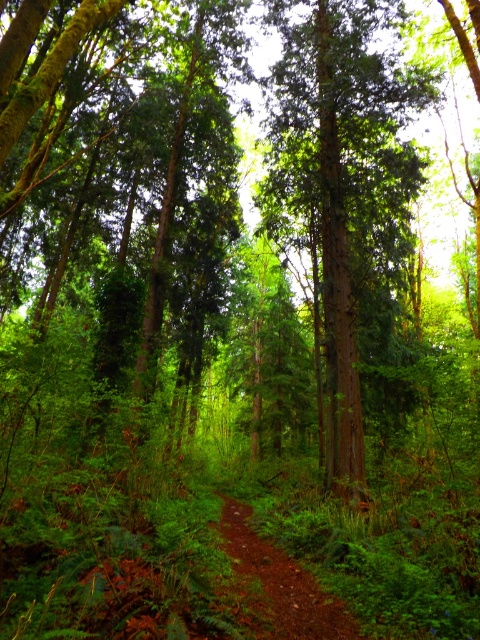
Can you confirm if green rough bark tree at center is wider than damp dirt trail at center?

Yes, green rough bark tree at center is wider than damp dirt trail at center.

Between green rough bark tree at center and damp dirt trail at center, which one appears on the right side from the viewer's perspective?

Positioned to the right is green rough bark tree at center.

At what (x,y) coordinates should I click in order to perform the action: click on green rough bark tree at center. Please return your answer as a coordinate pair (x, y). The image size is (480, 640). Looking at the image, I should click on [x=342, y=182].